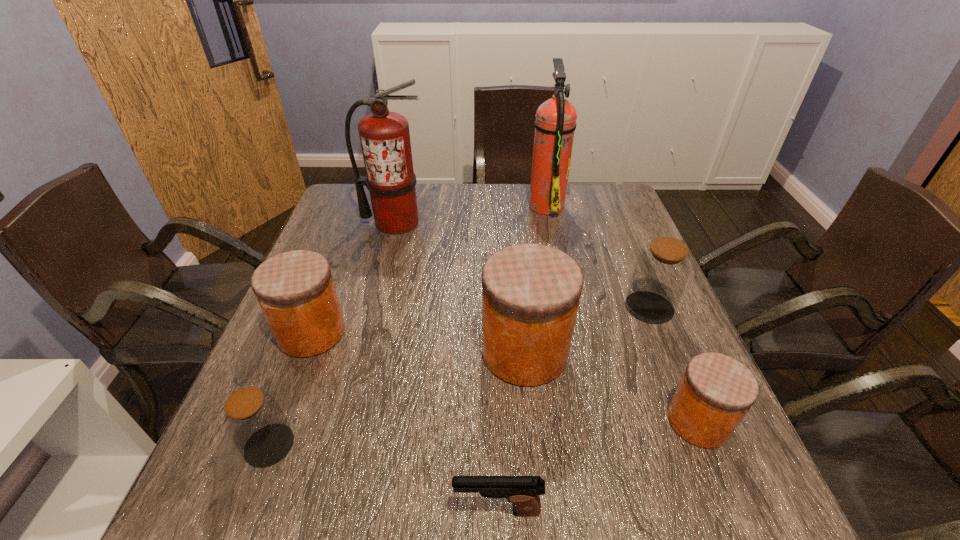
In the image, there is a desktop. Identify the location of blank space at the left edge. (243, 464).

You are a GUI agent. You are given a task and a screenshot of the screen. Output one action in this format:
    pyautogui.click(x=<x>, y=<y>)
    Task: Click on the free space at the right edge of the desktop
    
    Given the screenshot: What is the action you would take?
    pyautogui.click(x=696, y=450)

Image resolution: width=960 pixels, height=540 pixels. Identify the location of free space at the far left corner of the desktop. (345, 192).

In the image, there is a desktop. Where is `free space at the near left corner`? This screenshot has width=960, height=540. free space at the near left corner is located at coordinates click(x=252, y=510).

In the image, there is a desktop. Where is `vacant space at the far right corner`? The image size is (960, 540). vacant space at the far right corner is located at coordinates (580, 210).

This screenshot has height=540, width=960. What are the coordinates of `vacant area that lies between the nearest orange jar and the tallest jar` in the screenshot? It's located at (612, 387).

Image resolution: width=960 pixels, height=540 pixels. Find the location of `vacant region between the smallest orange jar and the right fire extinguisher`. vacant region between the smallest orange jar and the right fire extinguisher is located at coordinates (622, 313).

Image resolution: width=960 pixels, height=540 pixels. I want to click on vacant area that lies between the third jar from left to right and the left fire extinguisher, so click(x=460, y=287).

This screenshot has height=540, width=960. Find the location of `vacant space that's between the nearest orange jar and the second orange jar from right to left`. vacant space that's between the nearest orange jar and the second orange jar from right to left is located at coordinates (612, 387).

This screenshot has width=960, height=540. I want to click on unoccupied position between the red fire extinguisher and the right fire extinguisher, so click(470, 213).